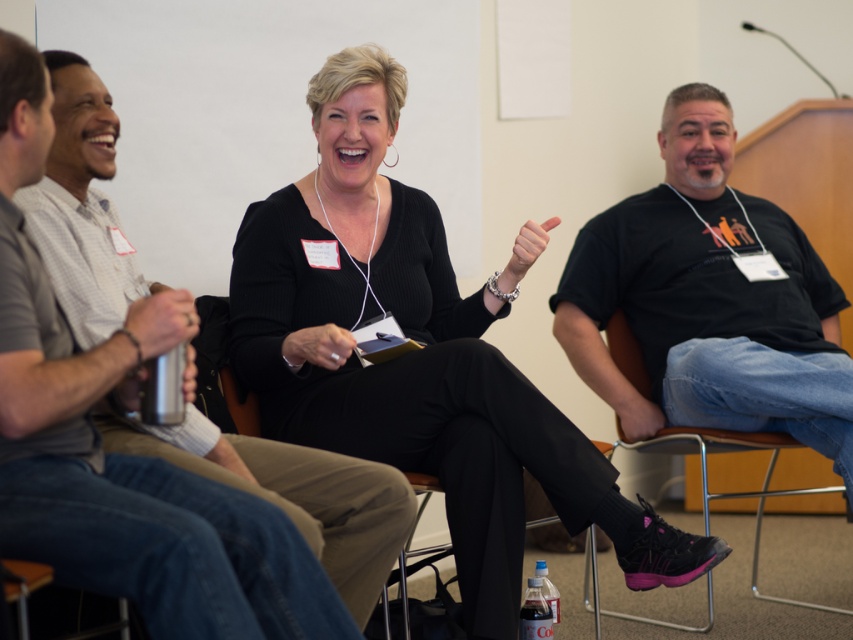
You are sitting in the conference room and want to move from the metallic silver chair at lower right to the black fabric chair at lower center. Can you do this without moving any other chairs?

The metallic silver chair at lower right is located above the black fabric chair at lower center, so you can move from the metallic silver chair at lower right to the black fabric chair at lower center without moving any other chairs.

In the scene shown: You are a person who is 1.8 meters tall and wants to sit comfortably in the conference room. You see the metallic silver chair at lower right and the black fabric chair at lower center. Which chair would allow you to sit without your knees hitting the table?

The metallic silver chair at lower right is taller than the black fabric chair at lower center, so the metallic silver chair at lower right would provide more legroom and prevent your knees from hitting the table.